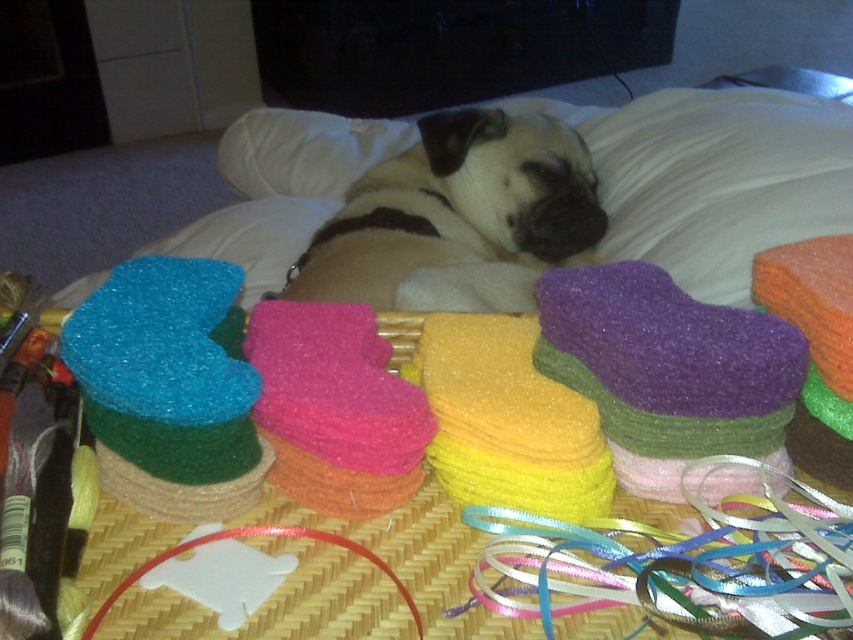
Who is higher up, matte beige dog at center or blue glittery heart at left?

Positioned higher is matte beige dog at center.

Who is taller, matte beige dog at center or blue glittery heart at left?

matte beige dog at center

Which is behind, point (405, 186) or point (99, 353)?

The point (405, 186) is more distant.

Where is `matte beige dog at center`? Image resolution: width=853 pixels, height=640 pixels. matte beige dog at center is located at coordinates coord(457,218).